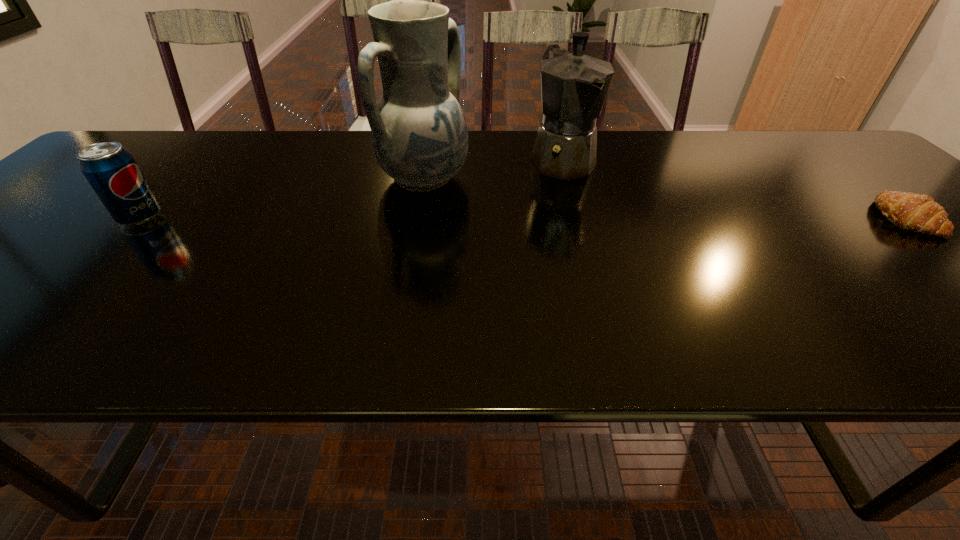
Identify the location of soda can. The width and height of the screenshot is (960, 540). (111, 170).

Locate an element on the screen. the leftmost object is located at coordinates (111, 170).

Locate an element on the screen. crescent roll is located at coordinates (916, 212).

This screenshot has height=540, width=960. I want to click on the shortest object, so click(x=916, y=212).

This screenshot has width=960, height=540. What are the coordinates of `the third object from right to left` in the screenshot? It's located at (419, 135).

Identify the location of the tallest object. point(419,135).

You are a GUI agent. You are given a task and a screenshot of the screen. Output one action in this format:
    pyautogui.click(x=<x>, y=<y>)
    Task: Click on the third shortest object
    The image size is (960, 540).
    Given the screenshot: What is the action you would take?
    pyautogui.click(x=574, y=86)

Locate an element on the screen. coffeepot is located at coordinates (574, 86).

You are a GUI agent. You are given a task and a screenshot of the screen. Output one action in this format:
    pyautogui.click(x=<x>, y=<y>)
    Task: Click on the free spot located 0.360m on the right of the leftmost object
    
    Given the screenshot: What is the action you would take?
    pyautogui.click(x=323, y=218)

I want to click on vacant space positioned on the back of the crescent roll, so click(848, 172).